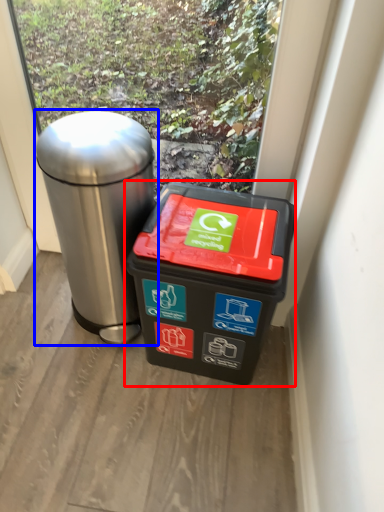
Question: Which object appears farthest to the camera in this image, waste container (highlighted by a red box) or waste container (highlighted by a blue box)?

Choices:
 (A) waste container
 (B) waste container

Answer: (A)